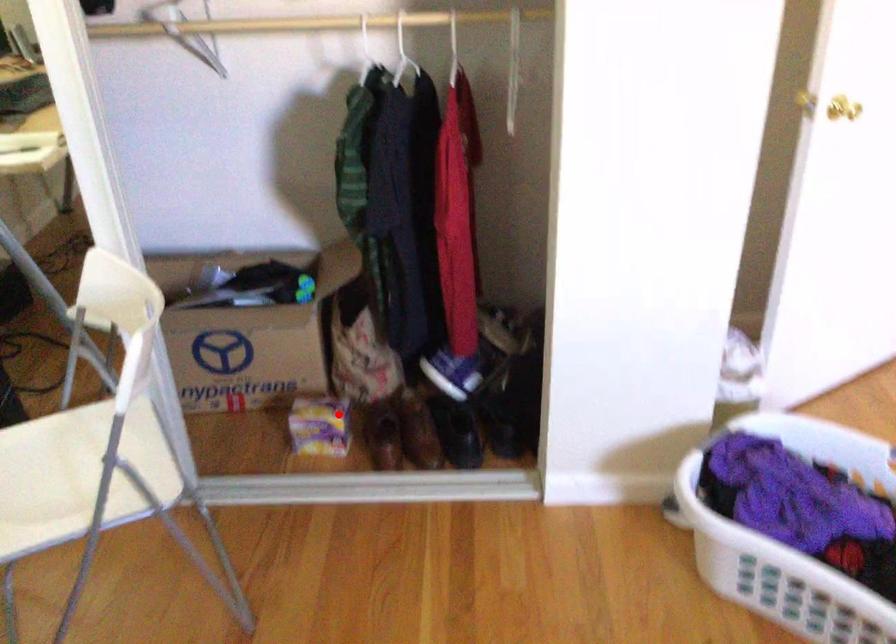
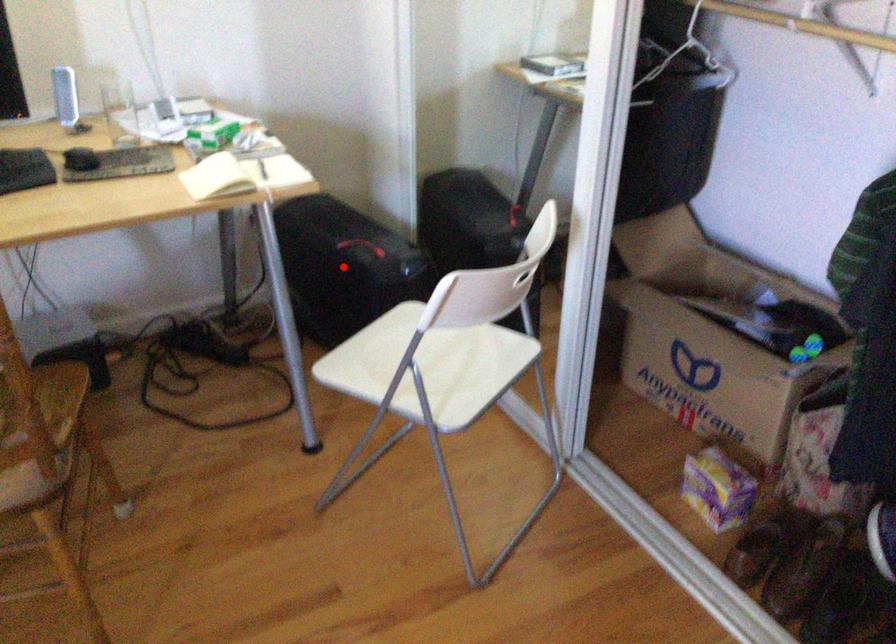
I am providing you with two images of the same scene from different viewpoints. A red point is marked on the first image and another point is marked on the second image. Is the red point in image1 aligned with the point shown in image2?

No